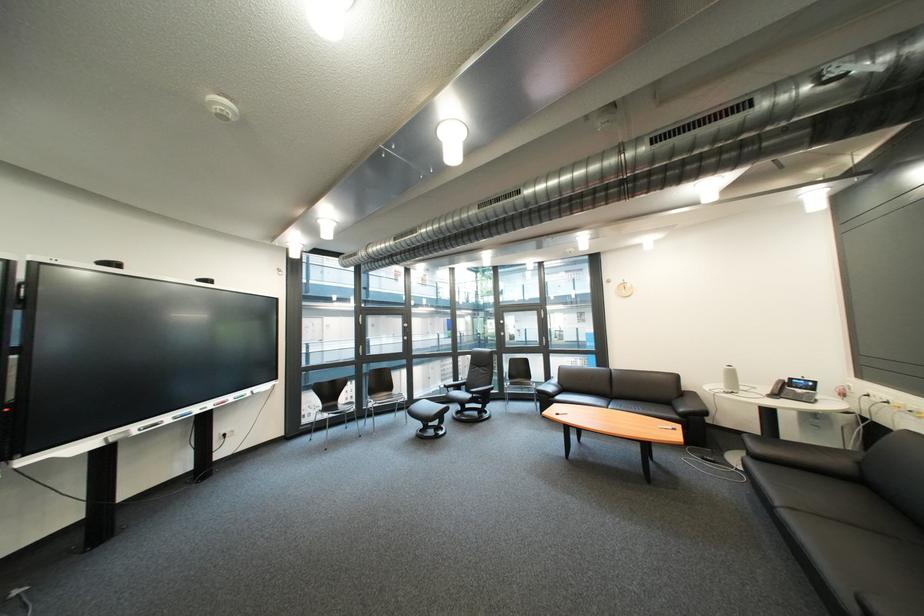
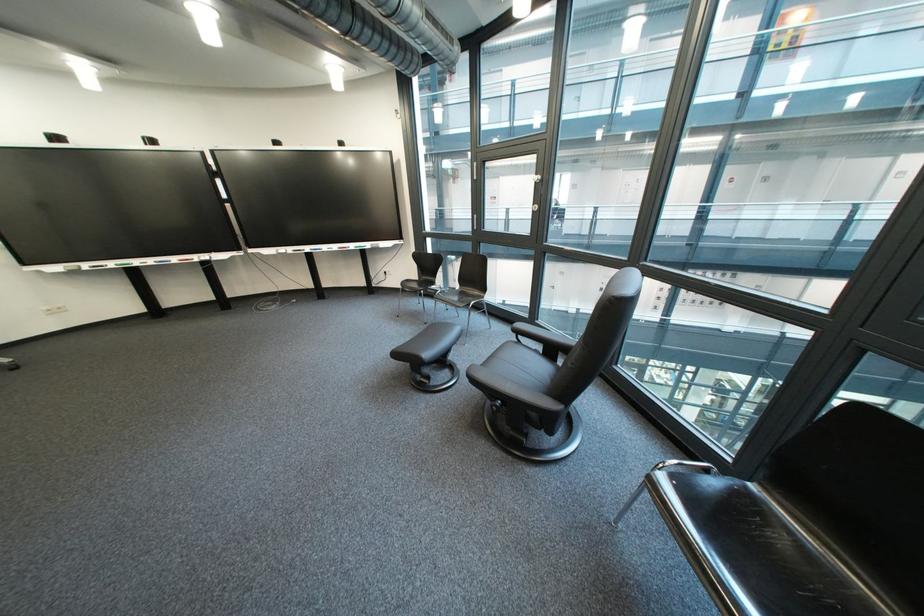
The point at (373, 438) is marked in the first image. Where is the corresponding point in the second image?

(439, 325)